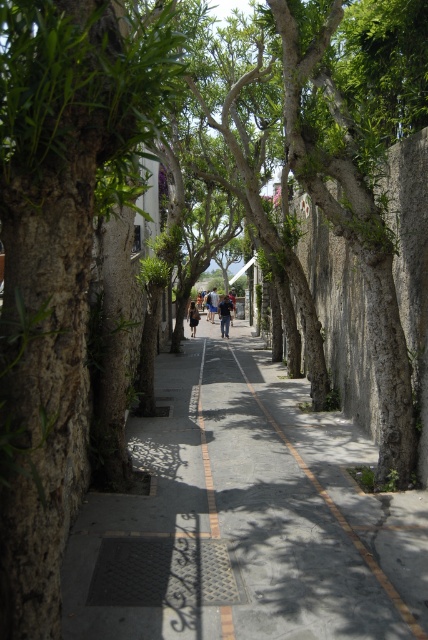
Question: Which object appears farthest from the camera in this image?

Choices:
 (A) light brown leather jacket at center
 (B) dark blue denim jeans at center
 (C) dark blue denim jacket at center

Answer: (A)

Question: Where is smooth concrete pavement at center located in relation to dark blue denim jacket at center in the image?

Choices:
 (A) below
 (B) above

Answer: (A)

Question: Which of the following is the farthest from the observer?

Choices:
 (A) (208, 292)
 (B) (211, 484)

Answer: (A)

Question: Can you confirm if light brown leather jacket at center is wider than dark blue denim jeans at center?

Choices:
 (A) no
 (B) yes

Answer: (B)

Question: Is the position of smooth concrete pavement at center less distant than that of dark blue denim jeans at center?

Choices:
 (A) no
 (B) yes

Answer: (B)

Question: Among these objects, which one is nearest to the camera?

Choices:
 (A) dark blue denim jacket at center
 (B) light brown leather jacket at center
 (C) smooth concrete pavement at center
 (D) dark blue denim jeans at center

Answer: (C)